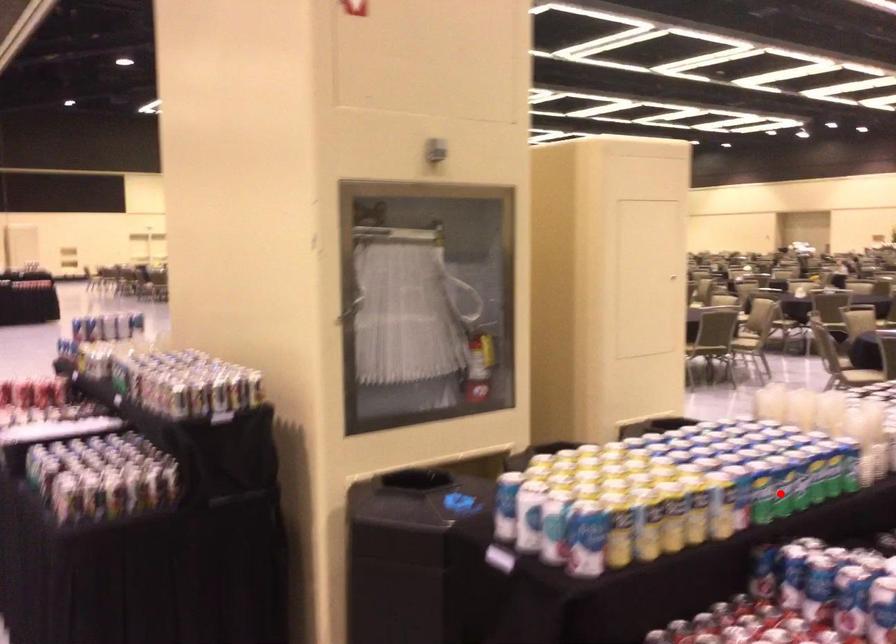
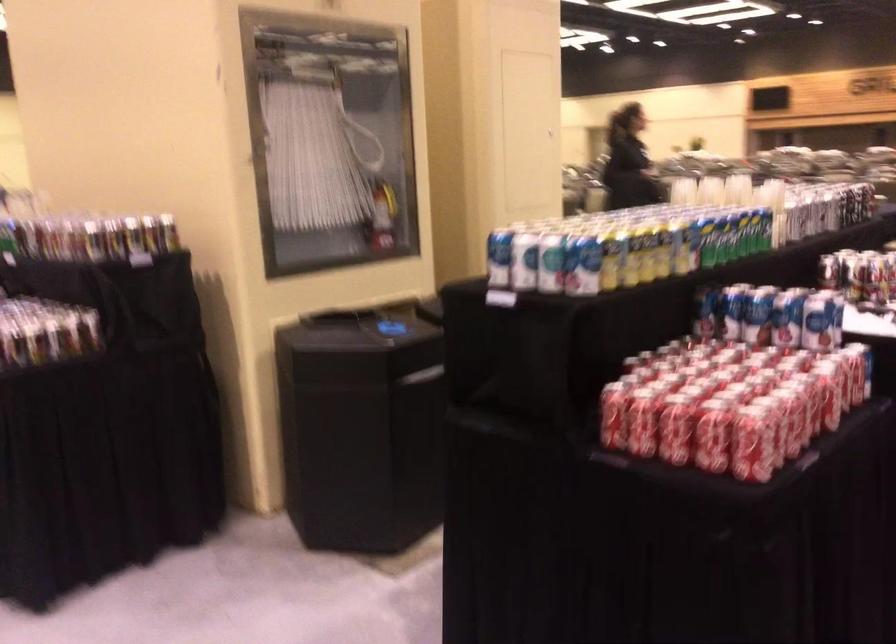
Find the pixel in the second image that matches the highlighted location in the first image.

(722, 238)